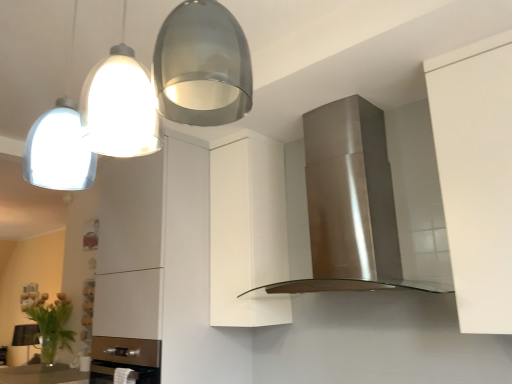
I want to click on free spot above stainless steel range hood at center (from a real-world perspective), so click(x=349, y=94).